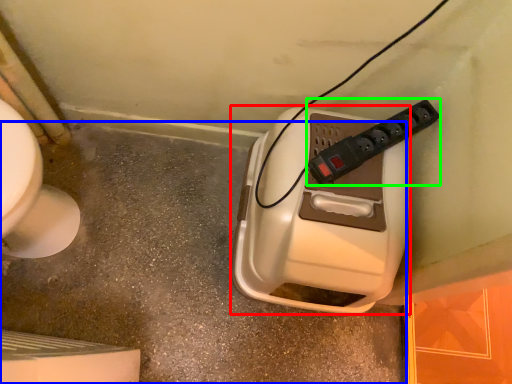
Question: Which object is positioned closest to hand dryer (highlighted by a red box)? Select from concrete (highlighted by a blue box) and power plugs and sockets (highlighted by a green box).

Choices:
 (A) concrete
 (B) power plugs and sockets

Answer: (B)